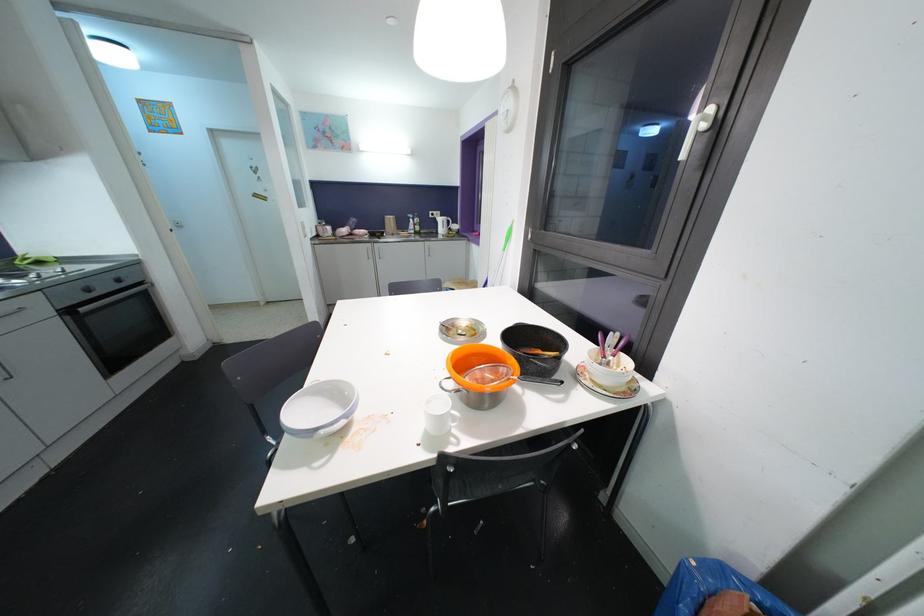
You are a GUI agent. You are given a task and a screenshot of the screen. Output one action in this format:
    pyautogui.click(x=<x>, y=<y>)
    Task: Click on the white ceramic bowl
    Image resolution: width=924 pixels, height=616 pixels.
    Given the screenshot: What is the action you would take?
    pyautogui.click(x=319, y=408)